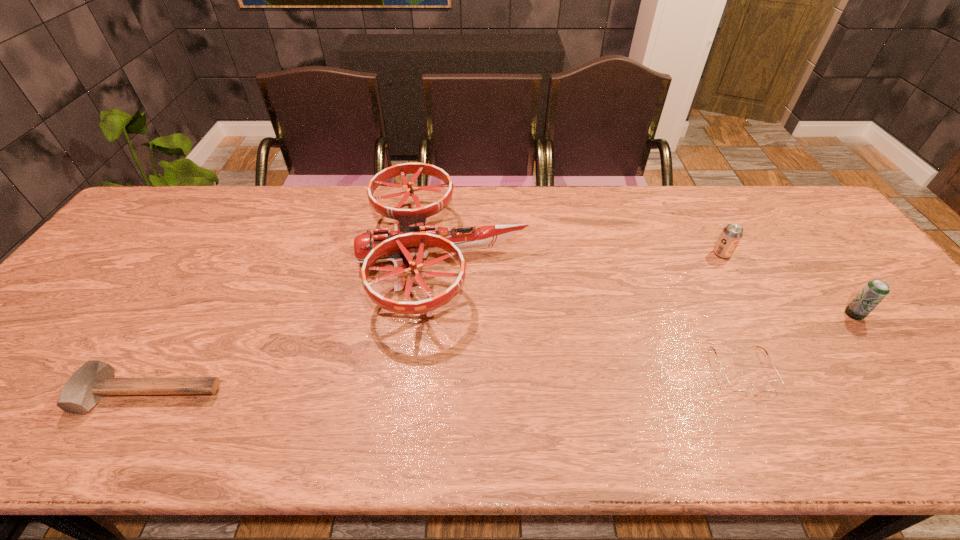
I want to click on vacant area between the tallest object and the third object from right to left, so (593, 313).

Locate an element on the screen. empty space between the drone and the left beer can is located at coordinates (583, 255).

Identify the location of free space between the second object from left to right and the right beer can. This screenshot has height=540, width=960. (649, 286).

Image resolution: width=960 pixels, height=540 pixels. Find the location of `the third closest object to the fourth object from left to right`. the third closest object to the fourth object from left to right is located at coordinates (411, 237).

Identify the location of object that is the second closest to the rightmost object. The height and width of the screenshot is (540, 960). (742, 385).

In order to click on free space that satisfies the following two spatial constraints: 1. on the front side of the second object from left to right; 2. on the left side of the right beer can in this screenshot , I will do `click(439, 314)`.

Find the location of a particular element. The image size is (960, 540). free location that satisfies the following two spatial constraints: 1. on the back side of the mallet; 2. on the left side of the left beer can is located at coordinates (230, 254).

Locate an element on the screen. free point that satisfies the following two spatial constraints: 1. on the front side of the farther beer can; 2. on the left side of the right beer can is located at coordinates (756, 314).

This screenshot has width=960, height=540. Find the location of `vacant space that satisfies the following two spatial constraints: 1. on the front side of the second object from right to left; 2. on the right side of the nearer beer can`. vacant space that satisfies the following two spatial constraints: 1. on the front side of the second object from right to left; 2. on the right side of the nearer beer can is located at coordinates (756, 314).